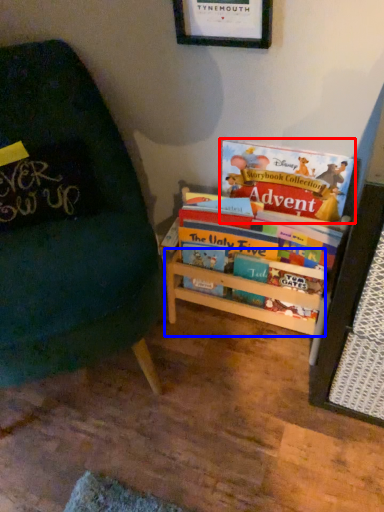
Question: Which point is closer to the camera, book (highlighted by a red box) or shelf (highlighted by a blue box)?

Choices:
 (A) book
 (B) shelf

Answer: (A)